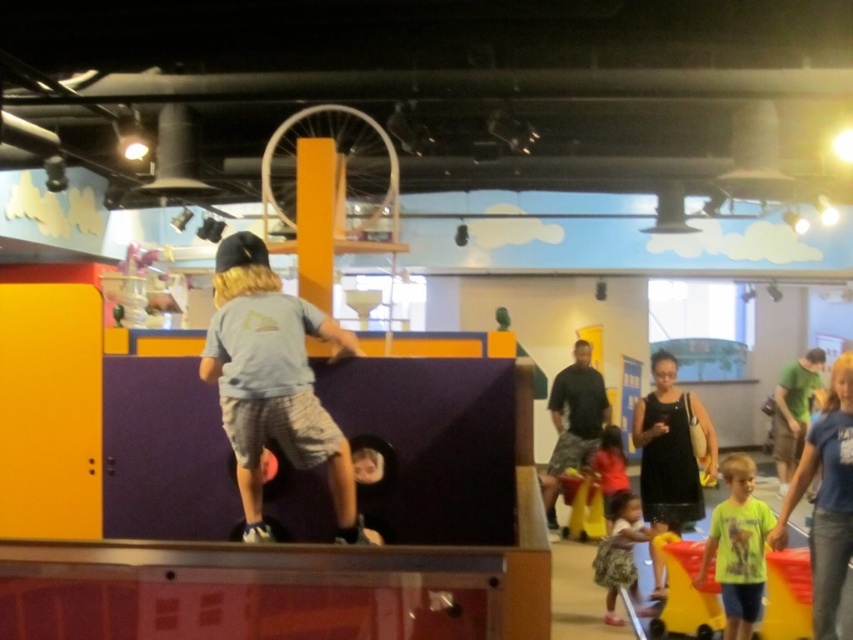
The height and width of the screenshot is (640, 853). Find the location of `green t-shirt at lower right`. green t-shirt at lower right is located at coordinates coord(827,497).

Which is above, green t-shirt at lower right or dark gray camouflage shorts at center?

green t-shirt at lower right is above.

Is point (827, 419) closer to camera compared to point (549, 529)?

That is True.

Find the location of a particular element. This screenshot has height=640, width=853. green t-shirt at lower right is located at coordinates (827, 497).

Does neon green t-shirt at lower right have a smaller size compared to dark gray camouflage shorts at center?

Yes.

Which is more to the right, neon green t-shirt at lower right or dark gray camouflage shorts at center?

From the viewer's perspective, neon green t-shirt at lower right appears more on the right side.

Who is more forward, (747,618) or (546,506)?

Point (747,618)

Locate an element on the screen. The image size is (853, 640). neon green t-shirt at lower right is located at coordinates (738, 547).

Between black dress at center and green t-shirt at lower right, which one has more height?

black dress at center

What do you see at coordinates (671, 449) in the screenshot? I see `black dress at center` at bounding box center [671, 449].

This screenshot has width=853, height=640. I want to click on black dress at center, so click(671, 449).